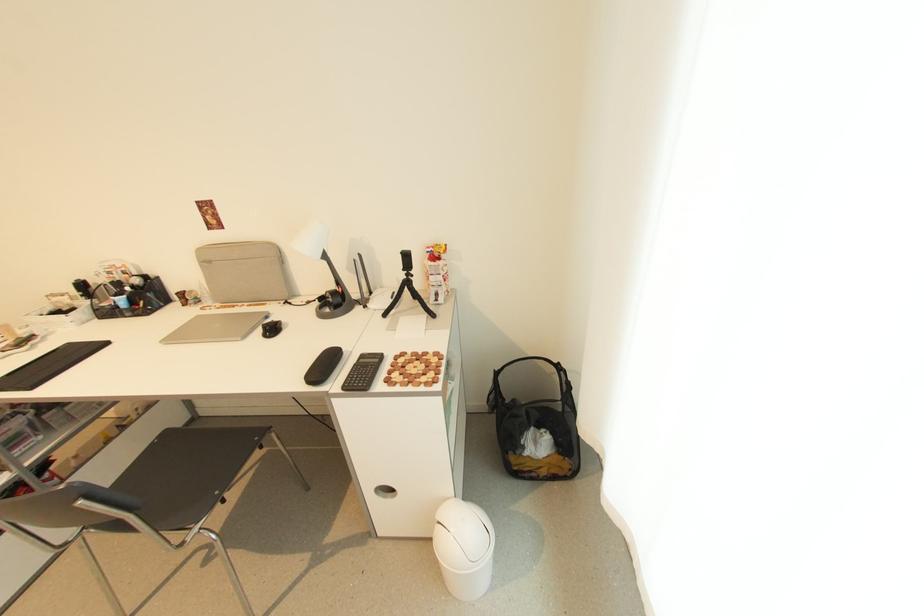
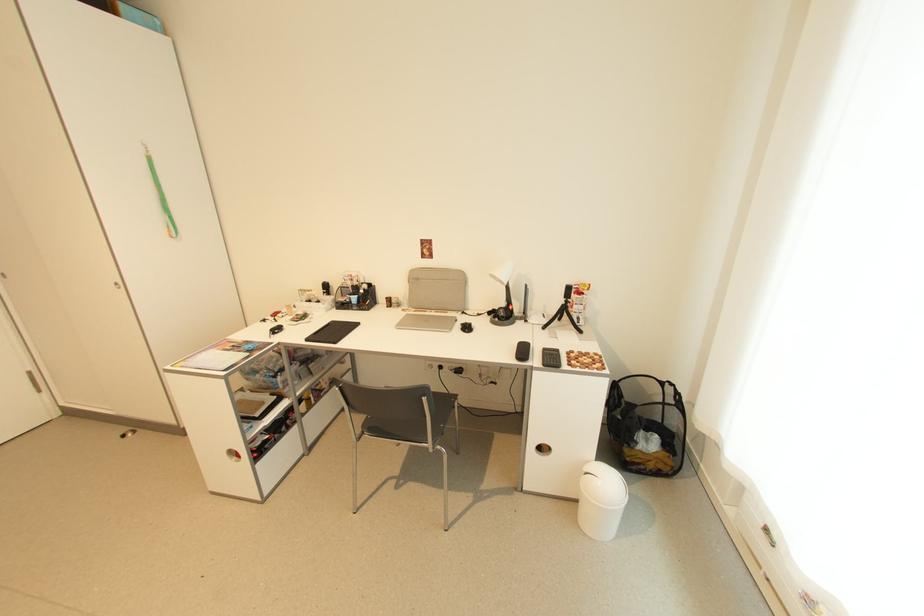
Find the pixel in the second image that matches pixel 348 390 in the first image.

(548, 367)